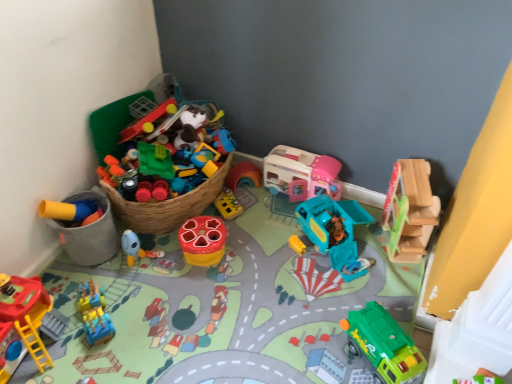
Where is `free space between blue rubber duck at center, which ranks as the sixth toy in right-to-left order, and blue plastic train at lower left, placed as the second toy when sorted from left to right`? The width and height of the screenshot is (512, 384). free space between blue rubber duck at center, which ranks as the sixth toy in right-to-left order, and blue plastic train at lower left, placed as the second toy when sorted from left to right is located at coordinates (126, 287).